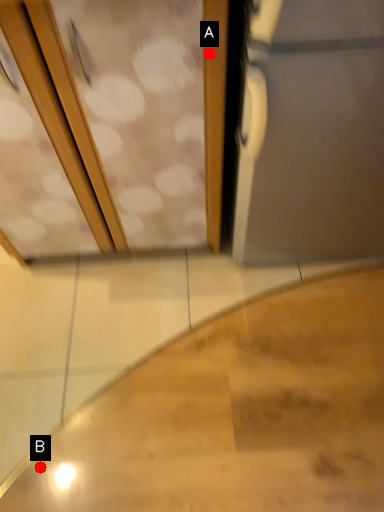
Question: Two points are circled on the image, labeled by A and B beside each circle. Which point appears closest to the camera in this image?

Choices:
 (A) A is closer
 (B) B is closer

Answer: (A)